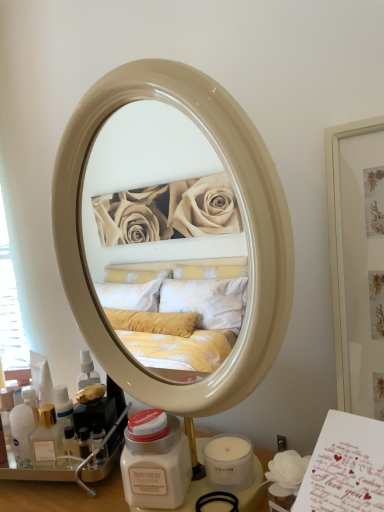
Question: Relative to matte white jar at lower center, is translucent plastic bottle at lower left in front or behind?

Choices:
 (A) front
 (B) behind

Answer: (B)

Question: Looking at the image, does translucent plastic bottle at lower left seem bigger or smaller compared to matte white jar at lower center?

Choices:
 (A) small
 (B) big

Answer: (A)

Question: Considering the positions of point (21, 448) and point (66, 493), is point (21, 448) closer or farther from the camera than point (66, 493)?

Choices:
 (A) closer
 (B) farther

Answer: (B)

Question: In terms of width, does matte white jar at lower center look wider or thinner when compared to translucent plastic bottle at lower left?

Choices:
 (A) thin
 (B) wide

Answer: (B)

Question: Is matte white jar at lower center taller or shorter than translucent plastic bottle at lower left?

Choices:
 (A) short
 (B) tall

Answer: (B)

Question: From the image's perspective, is matte white jar at lower center located above or below translucent plastic bottle at lower left?

Choices:
 (A) above
 (B) below

Answer: (A)

Question: Does point (114, 466) appear closer or farther from the camera than point (29, 396)?

Choices:
 (A) closer
 (B) farther

Answer: (A)